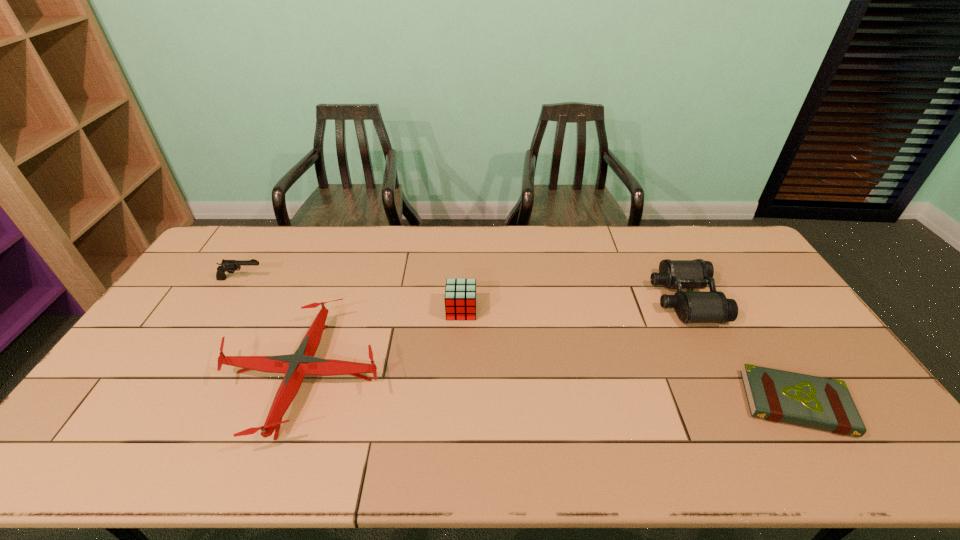
Identify the location of vacant area between the binoculars and the book. (740, 351).

Locate an element on the screen. The height and width of the screenshot is (540, 960). empty space that is in between the drone and the cube is located at coordinates (383, 343).

Locate an element on the screen. The width and height of the screenshot is (960, 540). vacant area that lies between the gun and the cube is located at coordinates click(x=351, y=294).

At what (x,y) coordinates should I click in order to perform the action: click on blank region between the second object from left to right and the cube. Please return your answer as a coordinate pair (x, y). Image resolution: width=960 pixels, height=540 pixels. Looking at the image, I should click on pyautogui.click(x=383, y=343).

I want to click on free point between the second object from left to right and the binoculars, so click(x=494, y=338).

Find the location of a particular element. vacant area that lies between the shortest object and the gun is located at coordinates (518, 341).

You are a GUI agent. You are given a task and a screenshot of the screen. Output one action in this format:
    pyautogui.click(x=<x>, y=<y>)
    Task: Click on the blank region between the binoculars and the cube
    The image size is (960, 540).
    Given the screenshot: What is the action you would take?
    pyautogui.click(x=573, y=305)

Find the location of a particular element. This screenshot has width=960, height=540. empty space between the binoculars and the second object from left to right is located at coordinates (494, 338).

Where is `empty space between the cube and the binoculars`? The width and height of the screenshot is (960, 540). empty space between the cube and the binoculars is located at coordinates (573, 305).

Select which object appears as the fourth closest to the book. Please provide its 2D coordinates. Your answer should be formatted as a tuple, i.e. [(x, y)], where the tuple contains the x and y coordinates of a point satisfying the conditions above.

[(230, 266)]